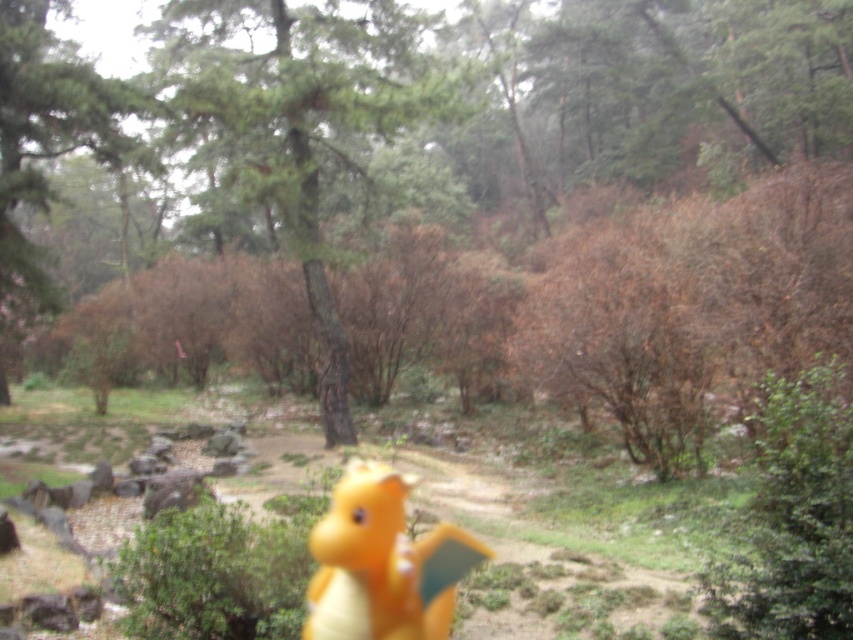
You are standing in a park on a cloudy day. You see a green matte tree at center. Where is the green matte tree located in relation to the coordinate point (582,163)?

The green matte tree at center is located exactly at the coordinate point (582,163).